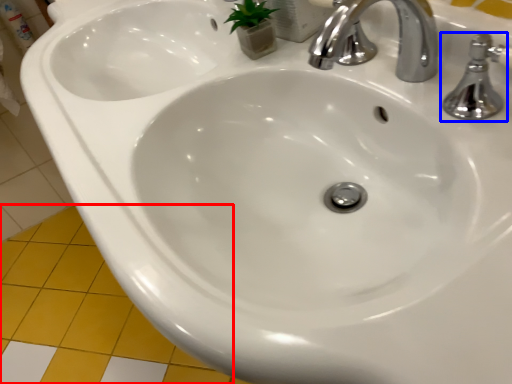
Question: Which object appears farthest to the camera in this image, ceramic tile (highlighted by a red box) or tap (highlighted by a blue box)?

Choices:
 (A) ceramic tile
 (B) tap

Answer: (A)